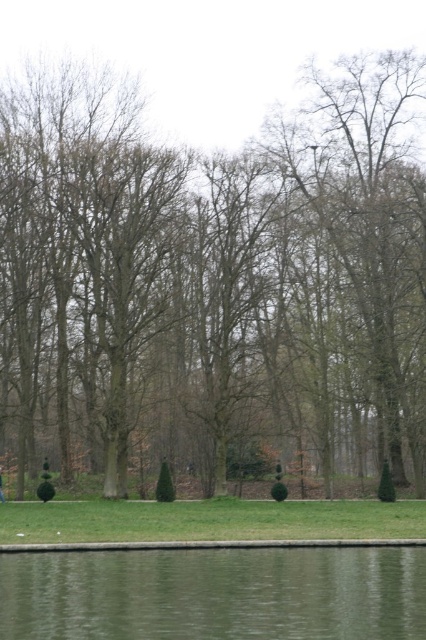
Question: Which point is closer to the camera?

Choices:
 (A) green reflective water at lower center
 (B) green fabric person at lower center
 (C) brown textured tree at center

Answer: (A)

Question: Which object appears farthest from the camera in this image?

Choices:
 (A) green fabric person at lower center
 (B) brown textured tree at center

Answer: (A)

Question: Estimate the real-world distances between objects in this image. Which object is farther from the green reflective water at lower center?

Choices:
 (A) green fabric person at lower center
 (B) brown textured tree at center

Answer: (A)

Question: Can you confirm if green reflective water at lower center is smaller than green fabric person at lower center?

Choices:
 (A) yes
 (B) no

Answer: (B)

Question: Is brown textured tree at center above green reflective water at lower center?

Choices:
 (A) no
 (B) yes

Answer: (B)

Question: From the image, what is the correct spatial relationship of green reflective water at lower center in relation to green fabric person at lower center?

Choices:
 (A) left
 (B) right

Answer: (B)